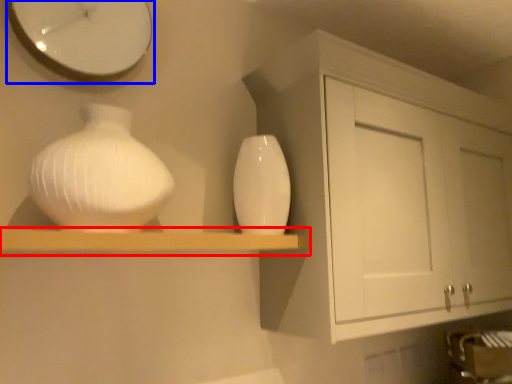
Question: Which point is closer to the camera, shelf (highlighted by a red box) or clock (highlighted by a blue box)?

Choices:
 (A) shelf
 (B) clock

Answer: (A)